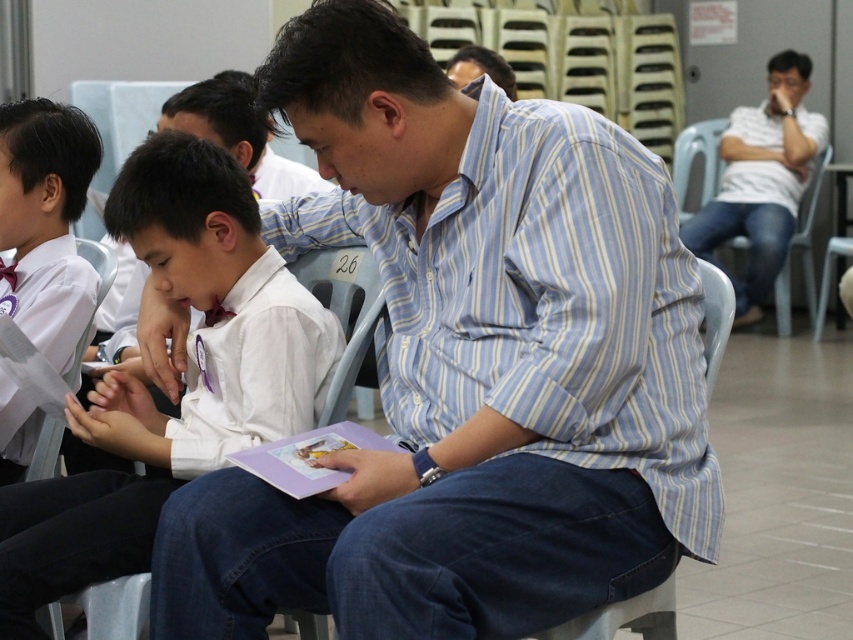
Which is in front, point (525, 412) or point (236, 365)?

Point (525, 412) is in front.

Does blue striped shirt at center appear over white shirt at center?

Yes, blue striped shirt at center is above white shirt at center.

This screenshot has width=853, height=640. In order to click on blue striped shirt at center in this screenshot , I will do `click(468, 365)`.

Can you confirm if blue striped shirt at center is positioned to the left of white uniform shirt at left?

In fact, blue striped shirt at center is to the right of white uniform shirt at left.

The width and height of the screenshot is (853, 640). What do you see at coordinates (468, 365) in the screenshot?
I see `blue striped shirt at center` at bounding box center [468, 365].

Is point (611, 518) more distant than point (94, 166)?

No, it is in front of (94, 166).

The image size is (853, 640). Find the location of `blue striped shirt at center`. blue striped shirt at center is located at coordinates [468, 365].

Who is more forward, (74,420) or (85,164)?

Point (74,420) is in front.

Does white shirt at center have a lesser width compared to white uniform shirt at left?

Incorrect, white shirt at center's width is not less than white uniform shirt at left's.

What do you see at coordinates (187, 378) in the screenshot?
I see `white shirt at center` at bounding box center [187, 378].

Identify the location of white shirt at center. (187, 378).